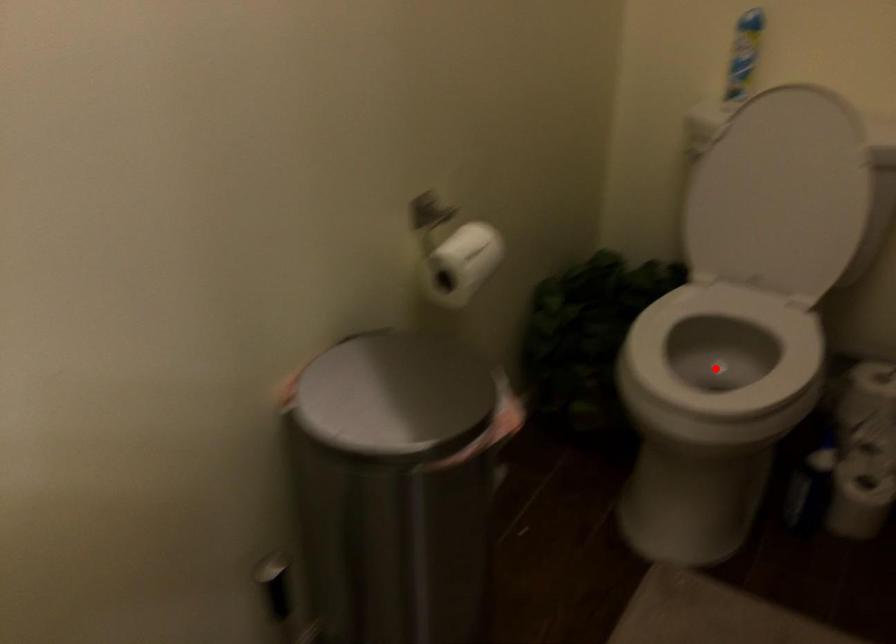
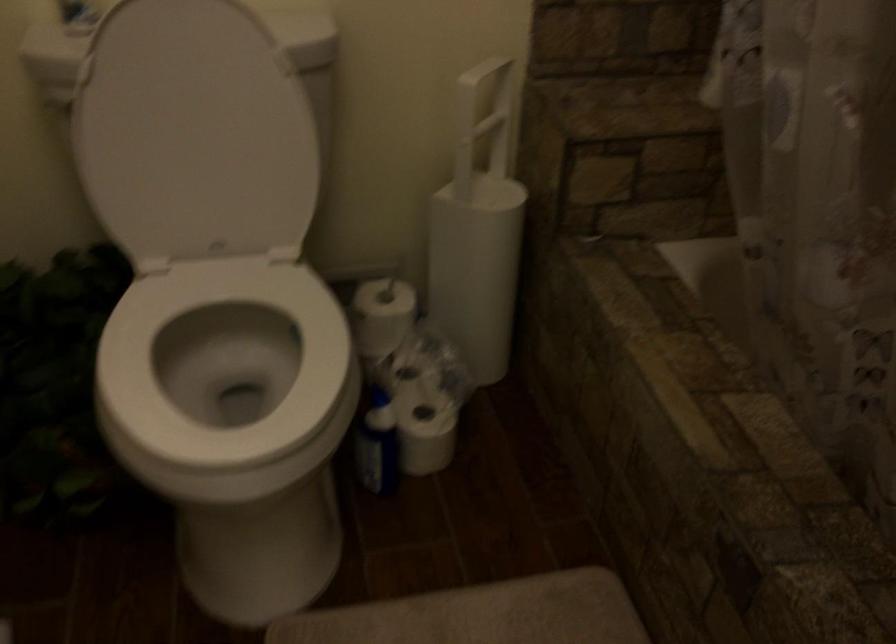
In the second image, find the point that corresponds to the highlighted location in the first image.

(224, 365)